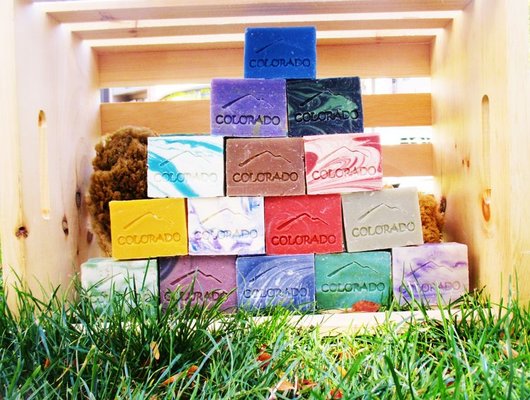
At what (x,y) coordinates should I click in order to perform the action: click on wooden case. Please return your answer as a coordinate pair (x, y). This screenshot has width=530, height=400. Looking at the image, I should click on (472, 134).